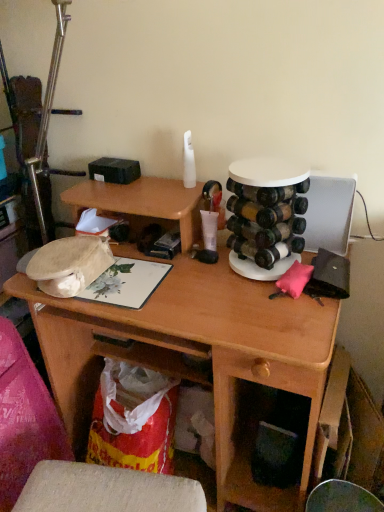
Measure the distance between wooden desk at center and camera.

A distance of 33.21 inches exists between wooden desk at center and camera.

The image size is (384, 512). What do you see at coordinates (192, 347) in the screenshot?
I see `wooden desk at center` at bounding box center [192, 347].

What is the approximate width of wooden desk at center?

wooden desk at center is 21.05 inches in width.

I want to click on wooden desk at center, so click(192, 347).

Find the location of a particular element. wooden desk at center is located at coordinates [192, 347].